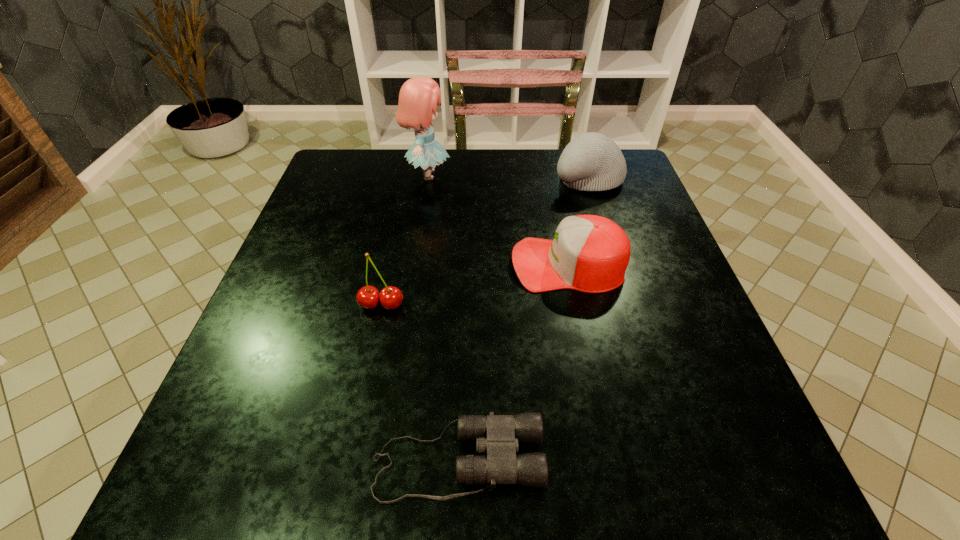
I want to click on free space at the left edge of the desktop, so click(x=345, y=224).

You are a GUI agent. You are given a task and a screenshot of the screen. Output one action in this format:
    pyautogui.click(x=<x>, y=<y>)
    Task: Click on the vacant space at the right edge of the desktop
    Image resolution: width=960 pixels, height=540 pixels.
    Given the screenshot: What is the action you would take?
    pyautogui.click(x=664, y=301)

You are a GUI agent. You are given a task and a screenshot of the screen. Output one action in this format:
    pyautogui.click(x=<x>, y=<y>)
    Task: Click on the free spot at the far left corner of the desktop
    This screenshot has height=540, width=960.
    Given the screenshot: What is the action you would take?
    point(348,164)

The image size is (960, 540). I want to click on free space at the far right corner, so click(x=611, y=194).

Find the location of a particular element. This screenshot has height=540, width=960. vacant space that's between the third farthest object and the cherry is located at coordinates (475, 284).

You are a GUI agent. You are given a task and a screenshot of the screen. Output one action in this format:
    pyautogui.click(x=<x>, y=<y>)
    Task: Click on the vacant point located between the baseball cap and the fourth farthest object
    Image resolution: width=960 pixels, height=540 pixels.
    Given the screenshot: What is the action you would take?
    pyautogui.click(x=475, y=284)

This screenshot has height=540, width=960. Find the location of `vacant point located between the baseball cap and the tallest object`. vacant point located between the baseball cap and the tallest object is located at coordinates pos(498,219).

Where is `vacant region between the beanie and the second nearest object`? This screenshot has height=540, width=960. vacant region between the beanie and the second nearest object is located at coordinates (485, 241).

Where is `free space between the cherry and the third nearest object`? This screenshot has height=540, width=960. free space between the cherry and the third nearest object is located at coordinates (475, 284).

The width and height of the screenshot is (960, 540). Identify the location of free space between the second nearest object and the tallest object. (404, 240).